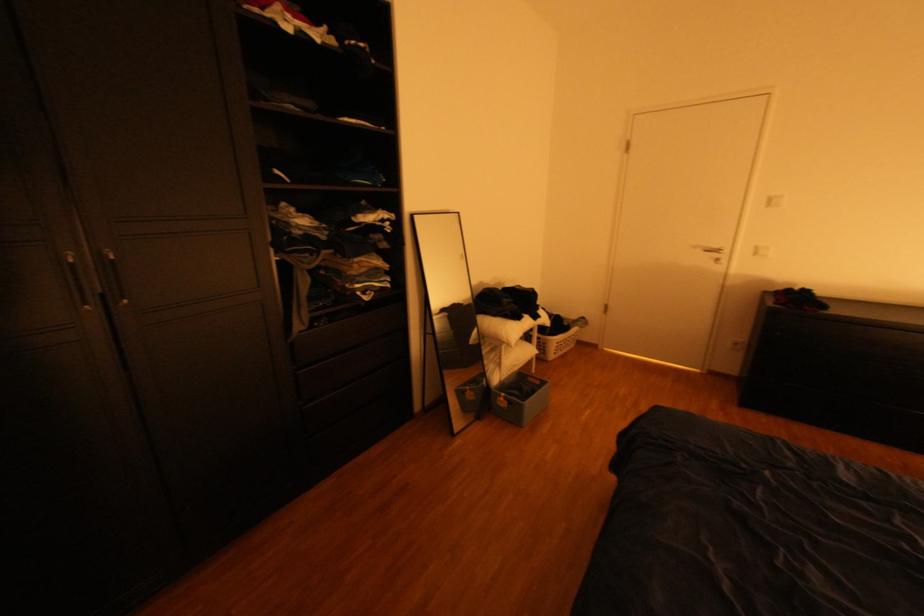
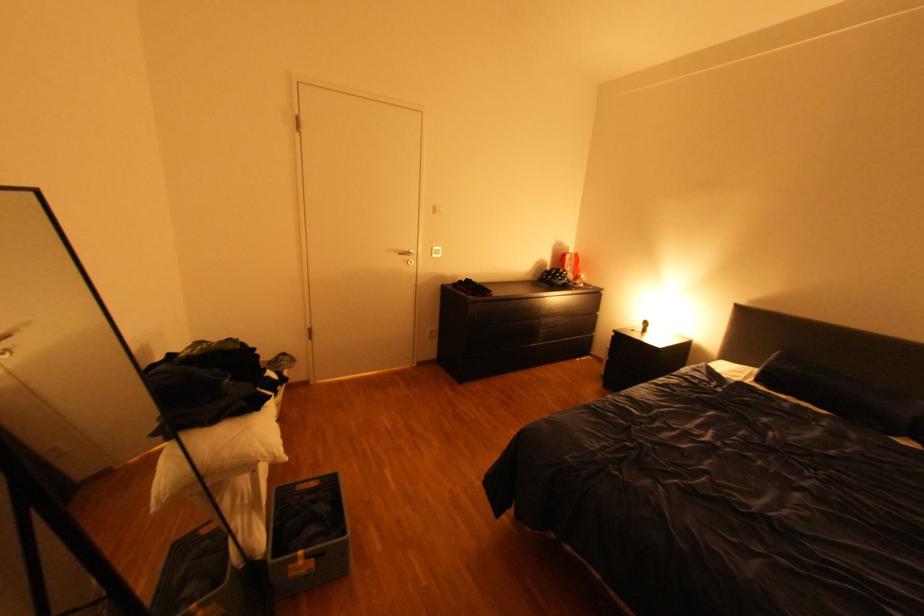
Find the pixel in the second image that matches [541,379] in the first image.

(310, 488)